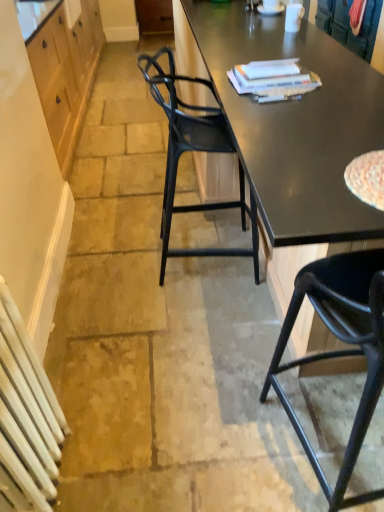
Question: Is black glossy desk at center located within white glossy coffee cup at upper center?

Choices:
 (A) no
 (B) yes

Answer: (A)

Question: Is white glossy coffee cup at upper center placed right next to black glossy desk at center?

Choices:
 (A) no
 (B) yes

Answer: (A)

Question: Is white glossy coffee cup at upper center wider than black glossy desk at center?

Choices:
 (A) no
 (B) yes

Answer: (A)

Question: From a real-world perspective, is white glossy coffee cup at upper center positioned over black glossy desk at center based on gravity?

Choices:
 (A) yes
 (B) no

Answer: (A)

Question: Is white glossy coffee cup at upper center at the right side of black glossy desk at center?

Choices:
 (A) yes
 (B) no

Answer: (A)

Question: Does point (94, 73) appear closer or farther from the camera than point (39, 475)?

Choices:
 (A) farther
 (B) closer

Answer: (A)

Question: From the image's perspective, is wooden cabinet at left positioned above or below white painted metal radiator at lower left?

Choices:
 (A) below
 (B) above

Answer: (B)

Question: Which is correct: wooden cabinet at left is inside white painted metal radiator at lower left, or outside of it?

Choices:
 (A) outside
 (B) inside

Answer: (A)

Question: Considering their positions, is wooden cabinet at left located in front of or behind white painted metal radiator at lower left?

Choices:
 (A) behind
 (B) front

Answer: (A)

Question: Based on their sizes in the image, would you say white glossy coffee cup at upper center is bigger or smaller than black plastic chair at center, acting as the 2th chair starting from the front?

Choices:
 (A) small
 (B) big

Answer: (A)

Question: From the image's perspective, relative to black plastic chair at center, the first chair viewed from the back, is white glossy coffee cup at upper center above or below?

Choices:
 (A) below
 (B) above

Answer: (B)

Question: Does point (291, 5) appear closer or farther from the camera than point (182, 142)?

Choices:
 (A) closer
 (B) farther

Answer: (B)

Question: Is white glossy coffee cup at upper center wider or thinner than black plastic chair at center, the first chair viewed from the back?

Choices:
 (A) thin
 (B) wide

Answer: (A)

Question: Relative to wooden cabinet at upper left, is white matte plate at upper center in front or behind?

Choices:
 (A) behind
 (B) front

Answer: (B)

Question: Does point (273, 8) appear closer or farther from the camera than point (16, 11)?

Choices:
 (A) closer
 (B) farther

Answer: (B)